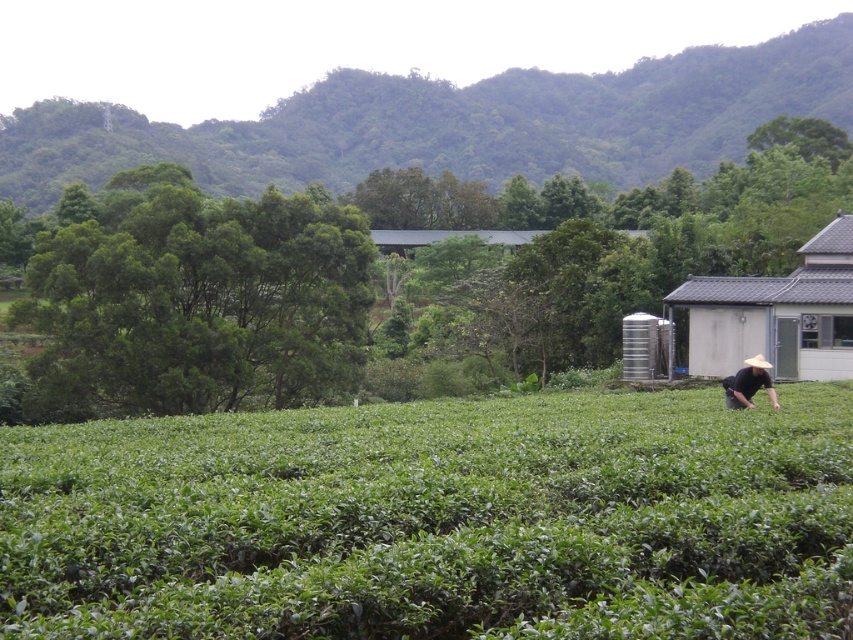
What do you see at coordinates (437, 518) in the screenshot? I see `green leafy field at lower center` at bounding box center [437, 518].

From the picture: How far apart are green leafy field at lower center and black straw hat at lower right?

A distance of 25.11 feet exists between green leafy field at lower center and black straw hat at lower right.

Between point (122, 538) and point (728, 392), which one is positioned behind?

Point (728, 392)

The image size is (853, 640). In order to click on green leafy field at lower center in this screenshot , I will do `click(437, 518)`.

Does green leafy field at lower center have a greater width compared to white textured hut at right?

Indeed, green leafy field at lower center has a greater width compared to white textured hut at right.

In the scene shown: Is green leafy field at lower center further to camera compared to white textured hut at right?

No, it is not.

What do you see at coordinates (437, 518) in the screenshot? The width and height of the screenshot is (853, 640). I see `green leafy field at lower center` at bounding box center [437, 518].

The width and height of the screenshot is (853, 640). I want to click on green leafy field at lower center, so click(437, 518).

Between white textured hut at right and black straw hat at lower right, which one has less height?

black straw hat at lower right is shorter.

Who is higher up, white textured hut at right or black straw hat at lower right?

Positioned higher is white textured hut at right.

Between point (749, 307) and point (764, 362), which one is positioned behind?

The point (749, 307) is behind.

This screenshot has width=853, height=640. I want to click on white textured hut at right, so click(x=776, y=314).